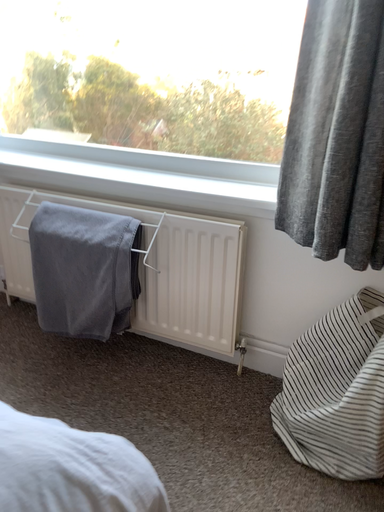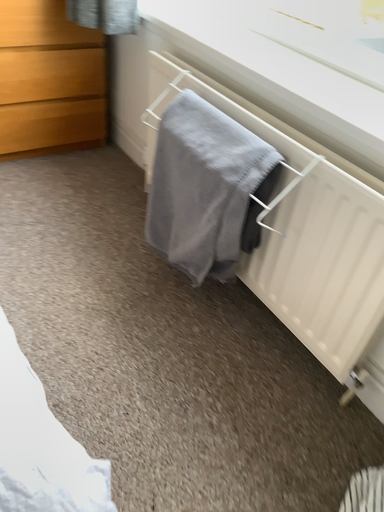
Question: How did the camera likely rotate when shooting the video?

Choices:
 (A) rotated downward
 (B) rotated upward

Answer: (A)